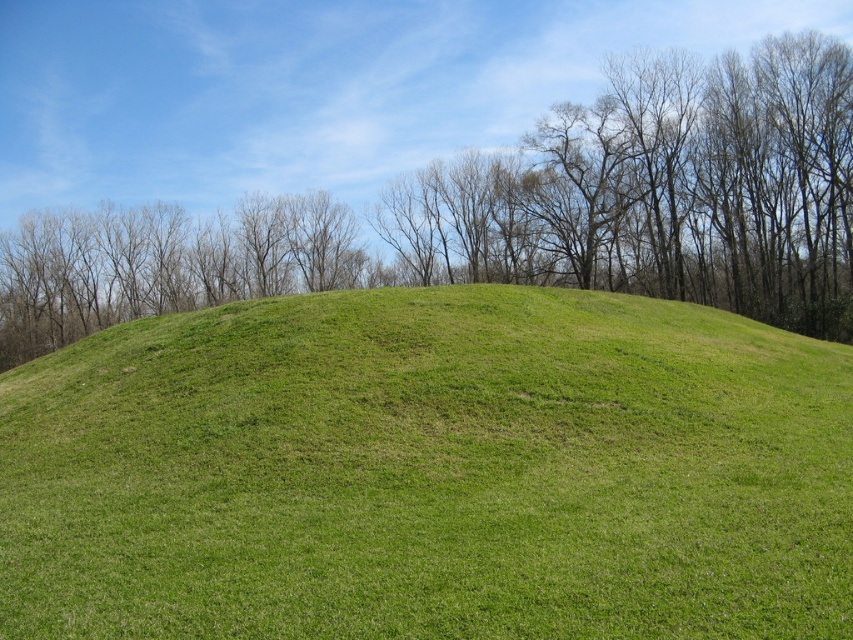
Question: Can you confirm if green grassy hill at center is wider than green grassy mound at center?

Choices:
 (A) no
 (B) yes

Answer: (A)

Question: Is green grassy hill at center further to the viewer compared to green grassy mound at center?

Choices:
 (A) yes
 (B) no

Answer: (B)

Question: Which point is closer to the camera taking this photo?

Choices:
 (A) (595, 465)
 (B) (699, 120)

Answer: (A)

Question: Which object appears closest to the camera in this image?

Choices:
 (A) green grassy mound at center
 (B) green grassy hill at center

Answer: (B)

Question: Does green grassy hill at center appear on the right side of green grassy mound at center?

Choices:
 (A) yes
 (B) no

Answer: (A)

Question: Among these objects, which one is farthest from the camera?

Choices:
 (A) green grassy mound at center
 (B) green grassy hill at center

Answer: (A)